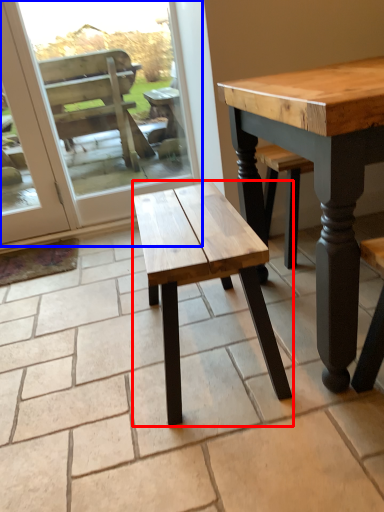
Question: Which of the following is the farthest to the observer, stool (highlighted by a red box) or screen door (highlighted by a blue box)?

Choices:
 (A) stool
 (B) screen door

Answer: (B)